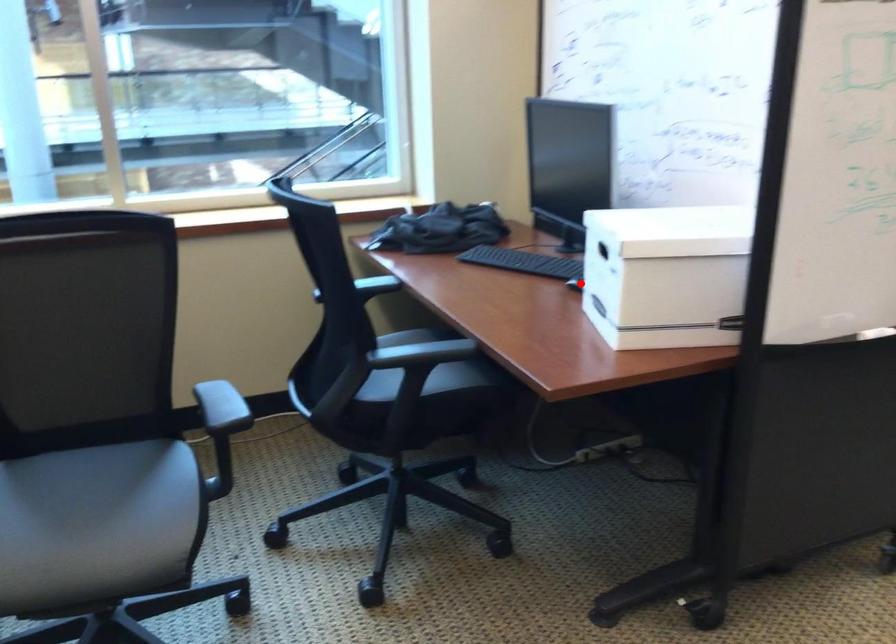
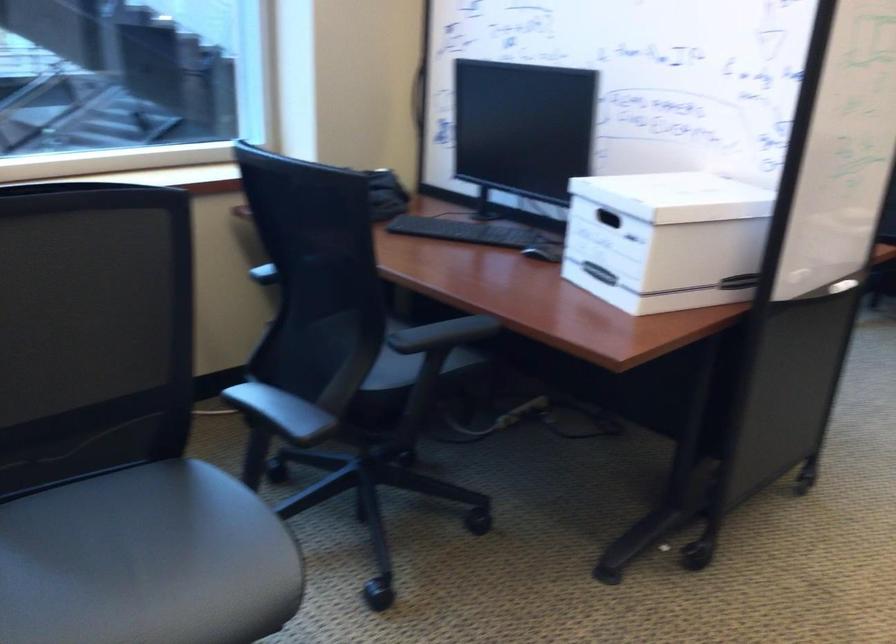
Question: I am providing you with two images of the same scene from different viewpoints. A red point is marked on the first image. Can you still see the location of the red point in image 2?

Choices:
 (A) Yes
 (B) No

Answer: (A)